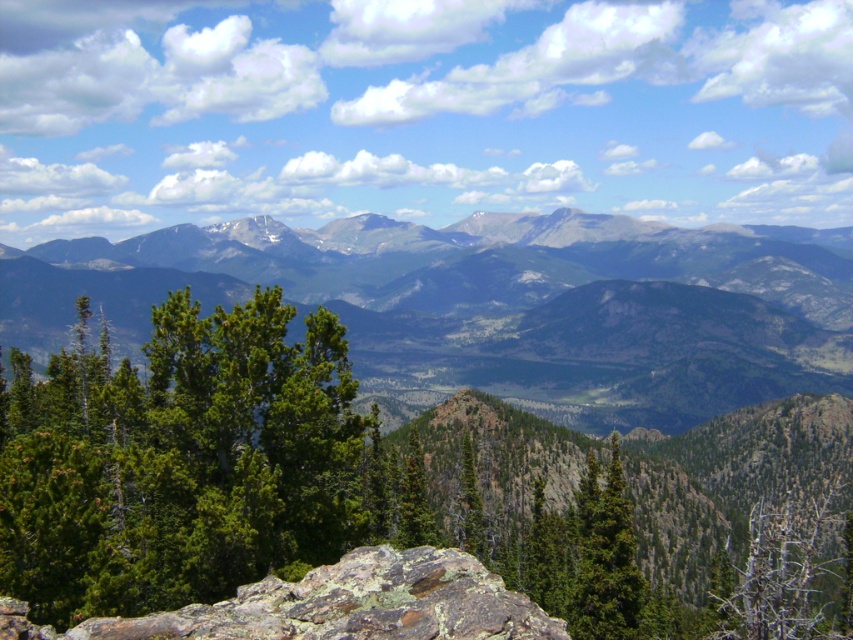
You are a hiker planning to cross the landscape. You need to know which area is wider to choose the safest path. Which is wider between the green forested mountain range at center and the dead wood at lower right?

The green forested mountain range at center is wider than the dead wood at lower right, so the safest path would be through the wider area, which is the green forested mountain range at center.